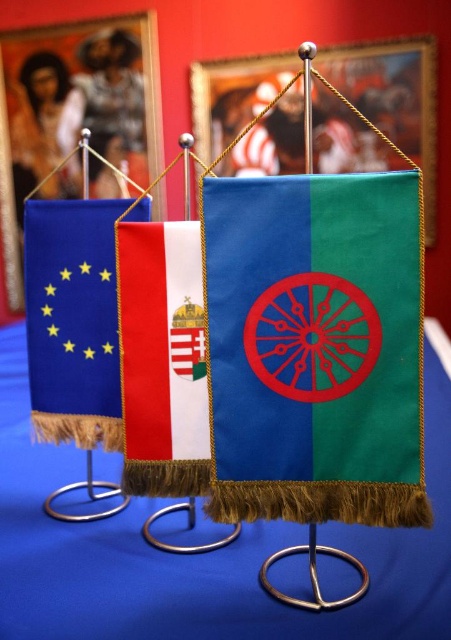
Question: Among these objects, which one is nearest to the camera?

Choices:
 (A) red velvet flag at center
 (B) blue fabric tablecloth at center

Answer: (B)

Question: Among these points, which one is nearest to the camera?

Choices:
 (A) (413, 564)
 (B) (386, 48)
 (C) (178, 419)

Answer: (A)

Question: Observing the image, what is the correct spatial positioning of green fabric flag at center in reference to blue fabric tablecloth at center?

Choices:
 (A) left
 (B) right

Answer: (B)

Question: Is red velvet flag at center behind blue fabric flag at left?

Choices:
 (A) no
 (B) yes

Answer: (A)

Question: Is green fabric flag at center smaller than red velvet flag at center?

Choices:
 (A) yes
 (B) no

Answer: (B)

Question: Which point is farther from the camera taking this photo?

Choices:
 (A) [392, 131]
 (B) [152, 404]
 (C) [243, 436]

Answer: (A)